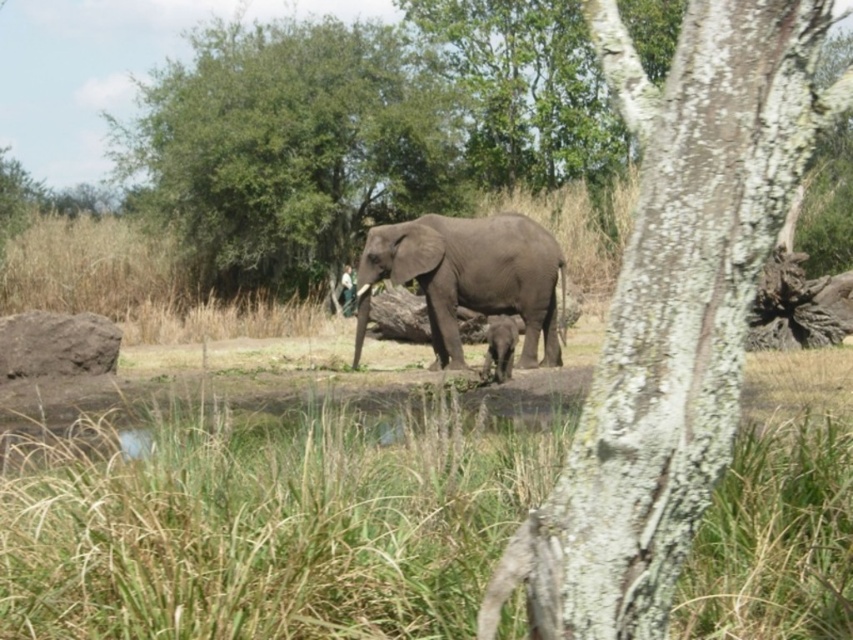
Can you confirm if gray rough bark tree trunk at center is taller than gray matte elephant at center?

No.

Between gray rough bark tree trunk at center and gray matte elephant at center, which one appears on the right side from the viewer's perspective?

gray matte elephant at center

Does point (709, 420) come in front of point (358, 352)?

Yes, it is in front of point (358, 352).

Find the location of a particular element. gray rough bark tree trunk at center is located at coordinates (672, 310).

Does gray matte elephant at center appear under gray matte baby elephant at center?

Actually, gray matte elephant at center is above gray matte baby elephant at center.

Does point (439, 323) lie behind point (498, 353)?

Yes, point (439, 323) is behind point (498, 353).

The width and height of the screenshot is (853, 640). Find the location of `gray matte elephant at center`. gray matte elephant at center is located at coordinates (473, 275).

Does point (817, 38) come farther from viewer compared to point (508, 374)?

No, (817, 38) is in front of (508, 374).

Does gray rough bark tree trunk at center appear on the left side of gray matte baby elephant at center?

Yes, gray rough bark tree trunk at center is to the left of gray matte baby elephant at center.

The width and height of the screenshot is (853, 640). Describe the element at coordinates (672, 310) in the screenshot. I see `gray rough bark tree trunk at center` at that location.

Where is `gray rough bark tree trunk at center`? The height and width of the screenshot is (640, 853). gray rough bark tree trunk at center is located at coordinates (672, 310).